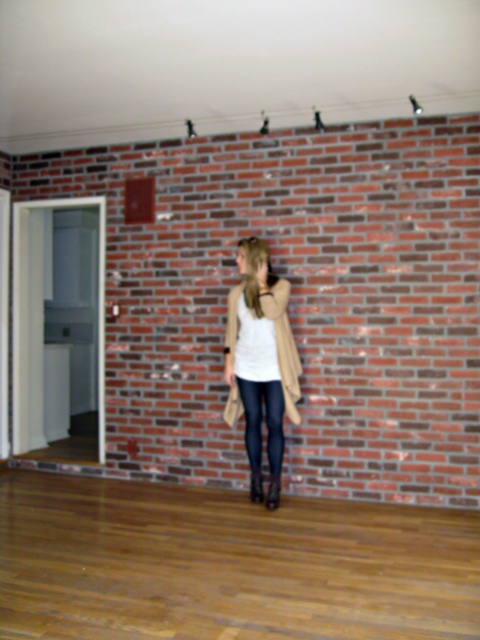
Can you confirm if beige textured coat at center is smaller than black leather leggings at center?

Actually, beige textured coat at center might be larger than black leather leggings at center.

Identify the location of beige textured coat at center. The width and height of the screenshot is (480, 640). (261, 360).

This screenshot has height=640, width=480. I want to click on beige textured coat at center, so click(261, 360).